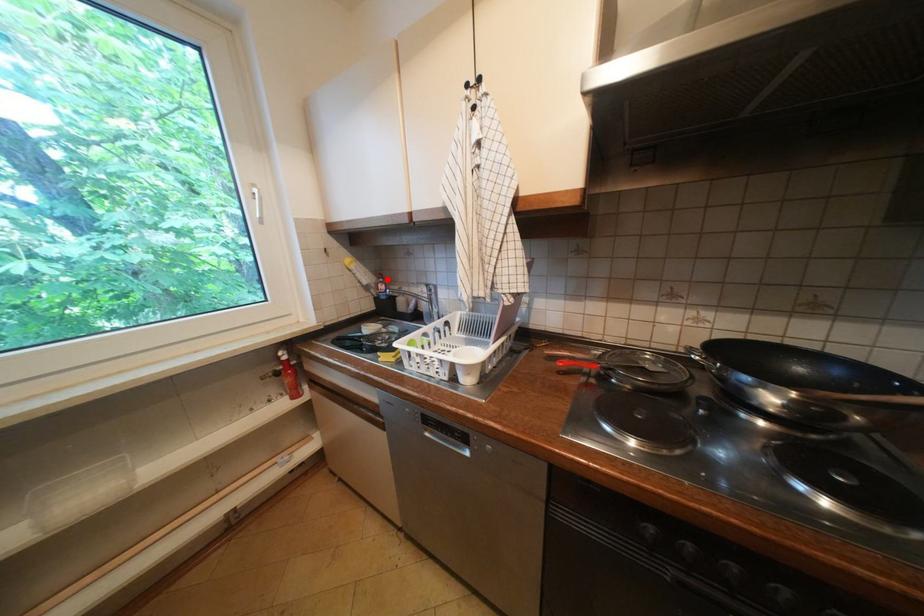
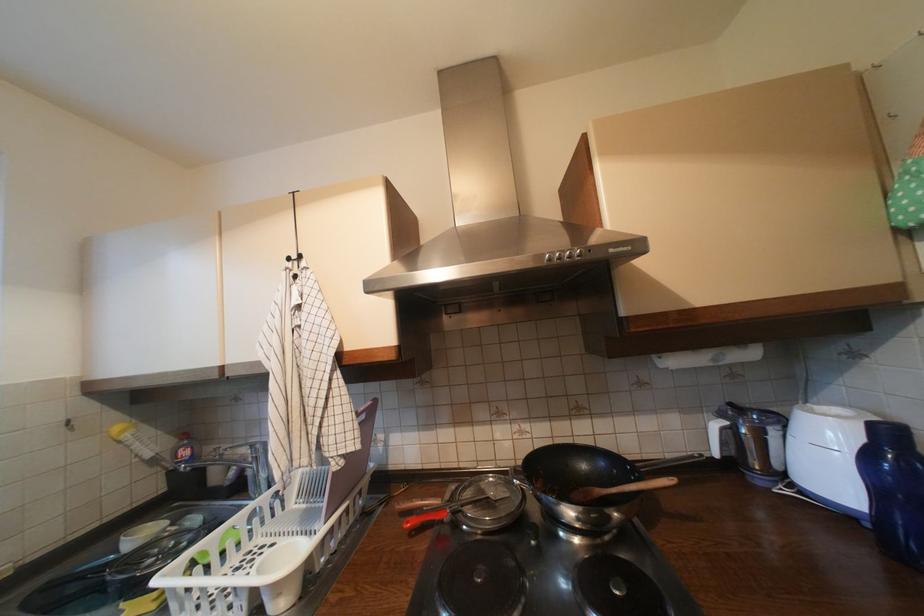
Locate, in the second image, the point that corresponds to the highlighted location in the first image.

(189, 440)